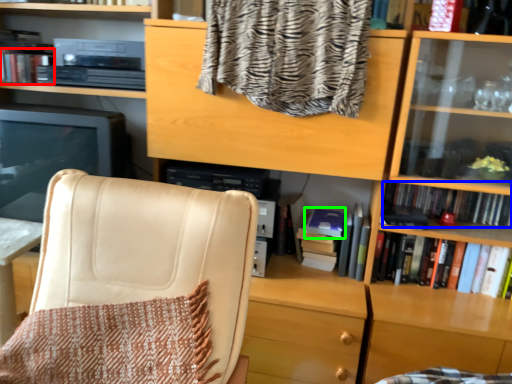
Question: Which is nearer to the book (highlighted by a red box)? book (highlighted by a blue box) or paperback book (highlighted by a green box).

Choices:
 (A) book
 (B) paperback book

Answer: (B)